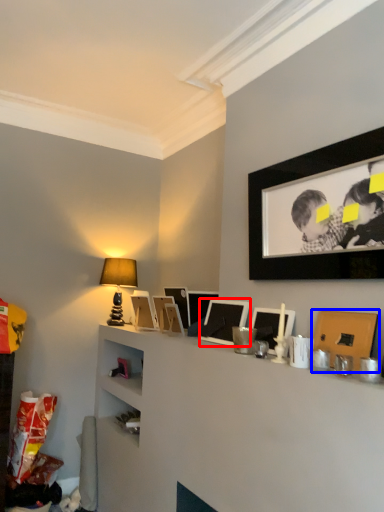
Question: Among these objects, which one is farthest to the camera, picture frame (highlighted by a red box) or picture frame (highlighted by a blue box)?

Choices:
 (A) picture frame
 (B) picture frame

Answer: (A)